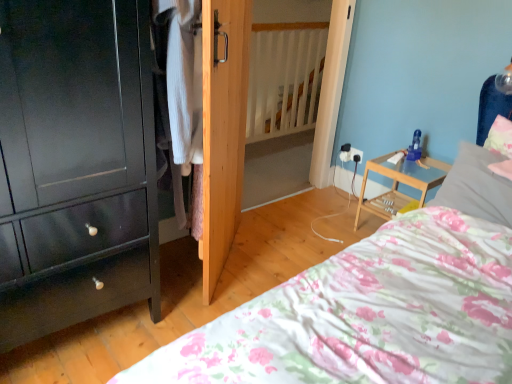
Question: Is knitted wool sweater at center facing towards white soft pillow at upper right, marked as the 2th pillow in a right-to-left arrangement?

Choices:
 (A) no
 (B) yes

Answer: (A)

Question: From a real-world perspective, is knitted wool sweater at center located higher than white soft pillow at upper right, marked as the 2th pillow in a right-to-left arrangement?

Choices:
 (A) yes
 (B) no

Answer: (A)

Question: Is knitted wool sweater at center not within white soft pillow at upper right, marked as the 2th pillow in a right-to-left arrangement?

Choices:
 (A) yes
 (B) no

Answer: (A)

Question: Does knitted wool sweater at center have a greater width compared to white soft pillow at upper right, marked as the 2th pillow in a right-to-left arrangement?

Choices:
 (A) yes
 (B) no

Answer: (B)

Question: Is knitted wool sweater at center positioned before white soft pillow at upper right, which is the 1th pillow from left to right?

Choices:
 (A) yes
 (B) no

Answer: (A)

Question: From a real-world perspective, is knitted wool sweater at center located beneath white soft pillow at upper right, which is the 1th pillow from left to right?

Choices:
 (A) no
 (B) yes

Answer: (A)

Question: Is fluffy pink pillow at upper right, the first pillow in the right-to-left sequence, positioned behind white soft pillow at upper right, which is the 1th pillow from left to right?

Choices:
 (A) no
 (B) yes

Answer: (B)

Question: From the image's perspective, is fluffy pink pillow at upper right, the first pillow in the right-to-left sequence, located beneath white soft pillow at upper right, which is the 1th pillow from left to right?

Choices:
 (A) yes
 (B) no

Answer: (B)

Question: Does fluffy pink pillow at upper right, the 2th pillow when ordered from left to right, contain white soft pillow at upper right, which is the 1th pillow from left to right?

Choices:
 (A) no
 (B) yes

Answer: (A)

Question: Is fluffy pink pillow at upper right, the 2th pillow when ordered from left to right, positioned far away from white soft pillow at upper right, which is the 1th pillow from left to right?

Choices:
 (A) no
 (B) yes

Answer: (A)

Question: From the image's perspective, is fluffy pink pillow at upper right, the first pillow in the right-to-left sequence, above white soft pillow at upper right, which is the 1th pillow from left to right?

Choices:
 (A) yes
 (B) no

Answer: (A)

Question: Does fluffy pink pillow at upper right, the first pillow in the right-to-left sequence, appear on the left side of white soft pillow at upper right, marked as the 2th pillow in a right-to-left arrangement?

Choices:
 (A) yes
 (B) no

Answer: (B)

Question: From a real-world perspective, is natural wood door at center under fluffy pink pillow at upper right, the first pillow in the right-to-left sequence?

Choices:
 (A) no
 (B) yes

Answer: (B)